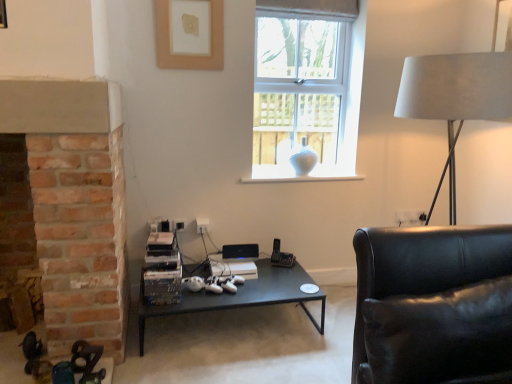
Question: Can you confirm if white fabric lampshade at right is thinner than white glass vase at upper center?

Choices:
 (A) yes
 (B) no

Answer: (B)

Question: Would you say white fabric lampshade at right is outside white glass vase at upper center?

Choices:
 (A) no
 (B) yes

Answer: (B)

Question: Considering the relative sizes of white fabric lampshade at right and white glass vase at upper center in the image provided, is white fabric lampshade at right taller than white glass vase at upper center?

Choices:
 (A) no
 (B) yes

Answer: (A)

Question: Is white fabric lampshade at right at the right side of white glass vase at upper center?

Choices:
 (A) no
 (B) yes

Answer: (B)

Question: Does white fabric lampshade at right lie in front of white glass vase at upper center?

Choices:
 (A) yes
 (B) no

Answer: (A)

Question: Is white fabric lampshade at right inside the boundaries of matte white picture frame at upper center, or outside?

Choices:
 (A) inside
 (B) outside

Answer: (B)

Question: Looking at the image, does white fabric lampshade at right seem bigger or smaller compared to matte white picture frame at upper center?

Choices:
 (A) small
 (B) big

Answer: (B)

Question: Relative to matte white picture frame at upper center, is white fabric lampshade at right in front or behind?

Choices:
 (A) behind
 (B) front

Answer: (B)

Question: From a real-world perspective, relative to matte white picture frame at upper center, is white fabric lampshade at right vertically above or below?

Choices:
 (A) above
 (B) below

Answer: (B)

Question: Considering the positions of white fabric lampshade at right and black leather couch at right in the image, is white fabric lampshade at right taller or shorter than black leather couch at right?

Choices:
 (A) short
 (B) tall

Answer: (B)

Question: From the image's perspective, relative to black leather couch at right, is white fabric lampshade at right above or below?

Choices:
 (A) below
 (B) above

Answer: (B)

Question: Considering their positions, is white fabric lampshade at right located in front of or behind black leather couch at right?

Choices:
 (A) behind
 (B) front

Answer: (A)

Question: Is white fabric lampshade at right wider or thinner than black leather couch at right?

Choices:
 (A) thin
 (B) wide

Answer: (A)

Question: From a real-world perspective, relative to black leather couch at right, is white glossy vase at center vertically above or below?

Choices:
 (A) above
 (B) below

Answer: (A)

Question: From their relative heights in the image, would you say white glossy vase at center is taller or shorter than black leather couch at right?

Choices:
 (A) tall
 (B) short

Answer: (B)